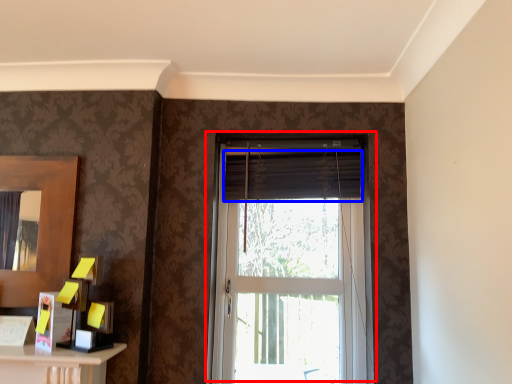
Question: Which of the following is the farthest to the observer, window (highlighted by a red box) or curtain (highlighted by a blue box)?

Choices:
 (A) window
 (B) curtain

Answer: (B)